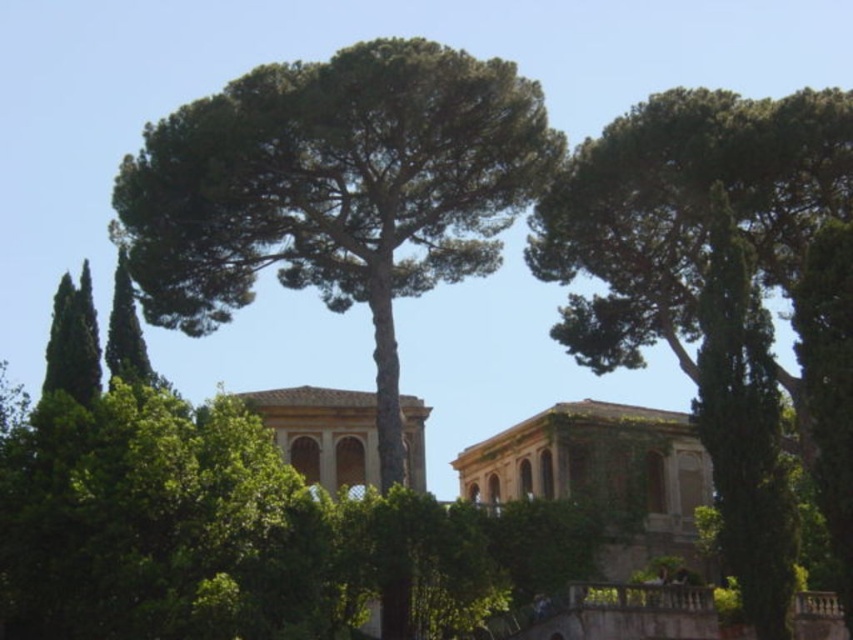
You are standing at the point marked by point (335, 189) in the image. Looking around, you see a green leafy tree at center. What direction should you face to see the classical building in the midground?

Since the point (335, 189) marks the green leafy tree at center, you should turn to face the midground area behind the tree to locate the classical building.

You are planning to place a bench between the green leafy tree at center and the green leafy tree at upper center. Which tree has a larger width that could provide more shade for the bench?

The green leafy tree at center might be wider than the green leafy tree at upper center, so it could provide more shade for the bench.

You are planning to install a new flagpole in the center of this outdoor area. Considering the green leafy tree at center and the brown stone palace at center, which object will the flagpole need to be taller than to ensure visibility from above the tree and the palace?

The flagpole needs to be taller than the green leafy tree at center because it is much taller than the brown stone palace at center, so exceeding the tree height ensures visibility over both.